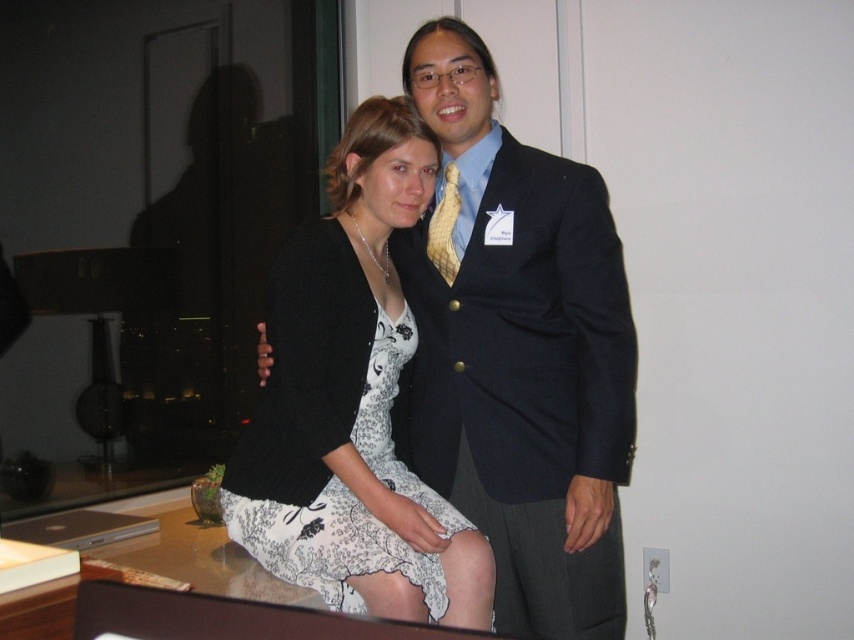
You are a photographer adjusting the camera height to ensure both the navy blue suit at center and the yellow woven tie at center are fully visible in the frame. Since the camera can only focus on objects of a certain height, which one should you adjust the focus for first?

The navy blue suit at center is taller than the yellow woven tie at center, so you should adjust the focus for the navy blue suit at center first to ensure proper framing and focus on the taller object.

You are a photographer setting up for a group photo. You need to ensure that the navy blue suit at center and the yellow woven tie at center are clearly visible in the frame. Given that your camera has a depth of field that can sharply focus on objects within a 10 inch range, will both items be in focus?

The navy blue suit at center is 11.11 inches away from the yellow woven tie at center. Since the distance between them exceeds the camera sensor depth of field range of 10 inches, only one of them will be in focus at a time.